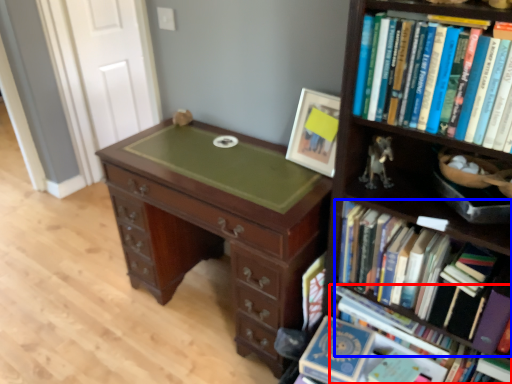
Question: Which object appears farthest to the camera in this image, book (highlighted by a red box) or book (highlighted by a blue box)?

Choices:
 (A) book
 (B) book

Answer: (A)